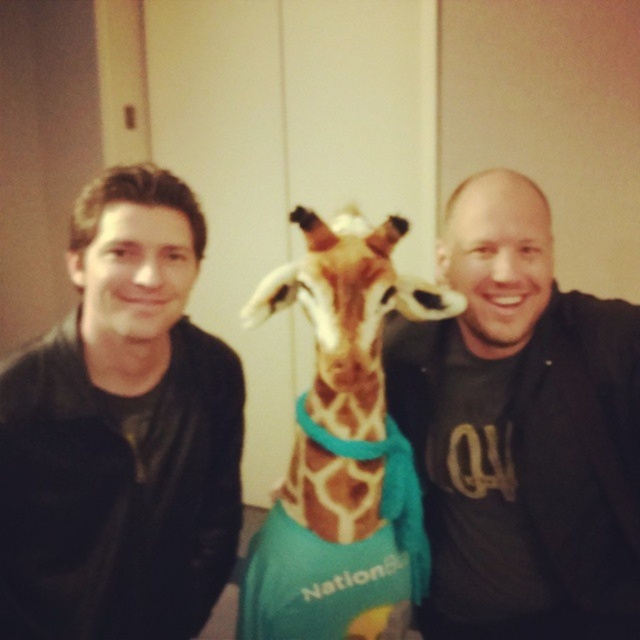
You are a photographer setting up a shoot with two people. You have a black leather jacket at left and a matte black shirt at right in the scene. Which clothing item is positioned more to the left?

The black leather jacket at left is positioned more to the left than the matte black shirt at right.

You are a photographer setting up for a portrait. You notice the matte black shirt at right and the spotted fur giraffe at center. Which object is closer to you, the photographer, when you are positioned in front of the subjects?

The matte black shirt at right is closer to you than the spotted fur giraffe at center because it is further to the viewer.

You are trying to decide which object is larger between the matte black shirt at right and the spotted fur giraffe at center. Based on the scene, which one is bigger?

The matte black shirt at right is bigger than the spotted fur giraffe at center.